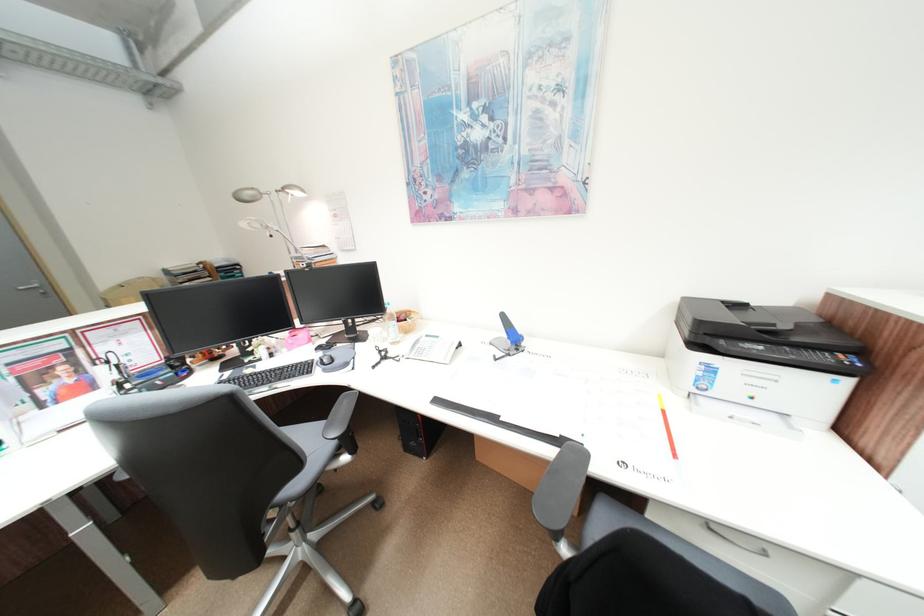
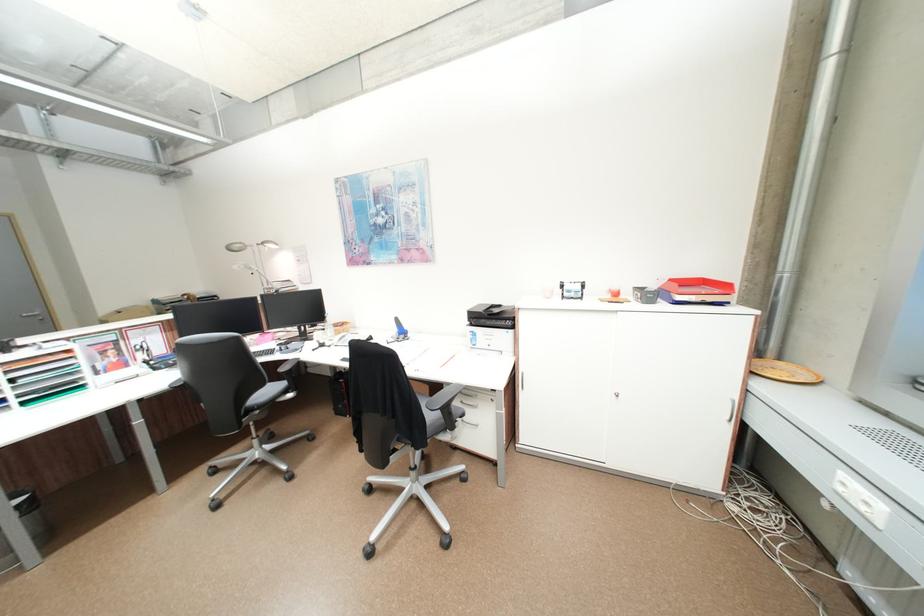
Find the pixel in the second image that matches [306,193] in the first image.

(281, 246)